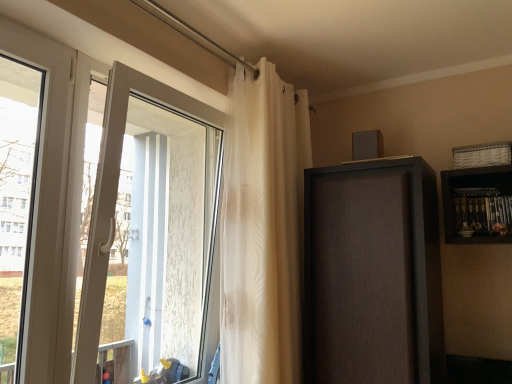
Question: In terms of size, does white glossy door at left appear bigger or smaller than translucent white curtain at upper center?

Choices:
 (A) big
 (B) small

Answer: (B)

Question: Do you think white glossy door at left is within translucent white curtain at upper center, or outside of it?

Choices:
 (A) outside
 (B) inside

Answer: (A)

Question: Which is farther from the translucent white curtain at upper center?

Choices:
 (A) white glossy door at left
 (B) matte brown cabinet at upper right
 (C) white plastic window at left

Answer: (C)

Question: Estimate the real-world distances between objects in this image. Which object is farther from the matte brown cabinet at upper right?

Choices:
 (A) white plastic window at left
 (B) white glossy door at left
 (C) translucent white curtain at upper center

Answer: (A)